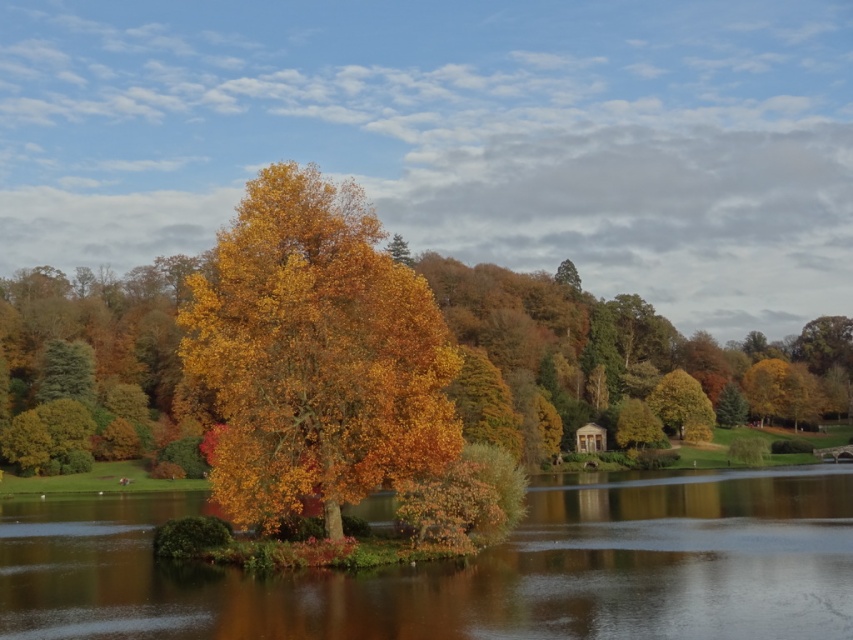
You are standing at the point marked by the coordinates point at (469, 568) in the image. What is the most likely surface you are standing on?

The point at (469, 568) marks transparent water at center, so you are standing on transparent water at center.

You are standing in the autumn landscape and want to take a photo of the transparent water at center and the green matte tree at upper right. Which object is closer to you, the photographer?

The transparent water at center is positioned under green matte tree at upper right, so the transparent water at center is closer to you since it is below the tree.